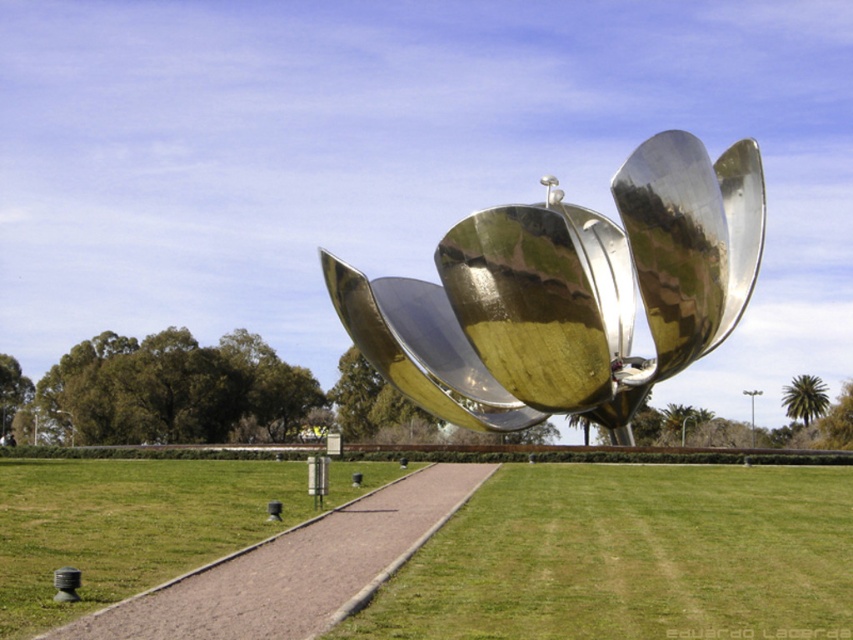
Question: Where is shiny metallic flower at center located in relation to green grass at center in the image?

Choices:
 (A) above
 (B) below

Answer: (A)

Question: Considering the relative positions of green grass at center and paved stone path at center in the image provided, where is green grass at center located with respect to paved stone path at center?

Choices:
 (A) below
 (B) above

Answer: (A)

Question: Does green grass at center appear over paved stone path at center?

Choices:
 (A) no
 (B) yes

Answer: (A)

Question: Which point is closer to the camera?

Choices:
 (A) (115, 630)
 (B) (372, 300)
 (C) (589, 477)

Answer: (A)

Question: Estimate the real-world distances between objects in this image. Which object is farther from the green grass at center?

Choices:
 (A) shiny metallic flower at center
 (B) paved stone path at center

Answer: (A)

Question: Based on their relative distances, which object is nearer to the green grass at center?

Choices:
 (A) shiny metallic flower at center
 (B) paved stone path at center

Answer: (B)